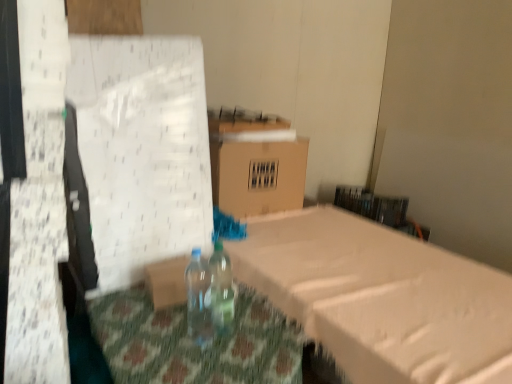
At what (x,y) coordinates should I click in order to perform the action: click on blank space to the left of transparent plastic bottle at center, the first bottle when ordered from right to left. Please return your answer as a coordinate pair (x, y). Looking at the image, I should click on (184, 319).